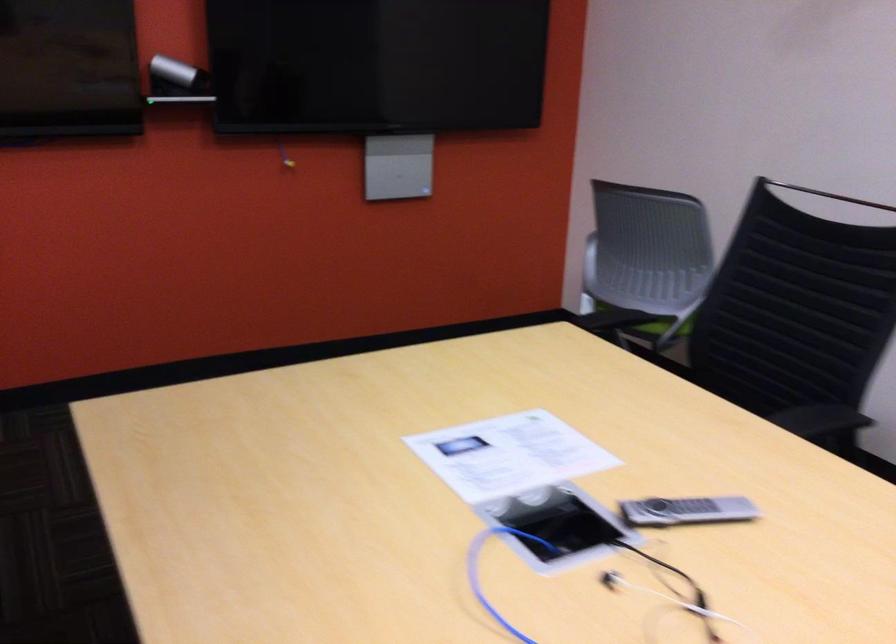
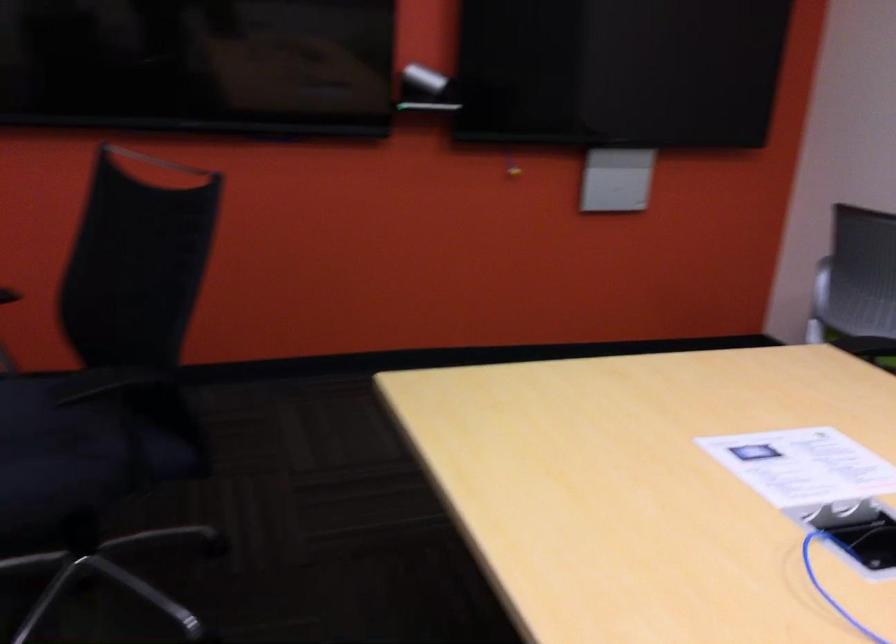
Question: The camera is either moving clockwise (left) or counter-clockwise (right) around the object. The first image is from the beginning of the video and the second image is from the end. Is the camera moving left or right when shooting the video?

Choices:
 (A) Left
 (B) Right

Answer: (B)